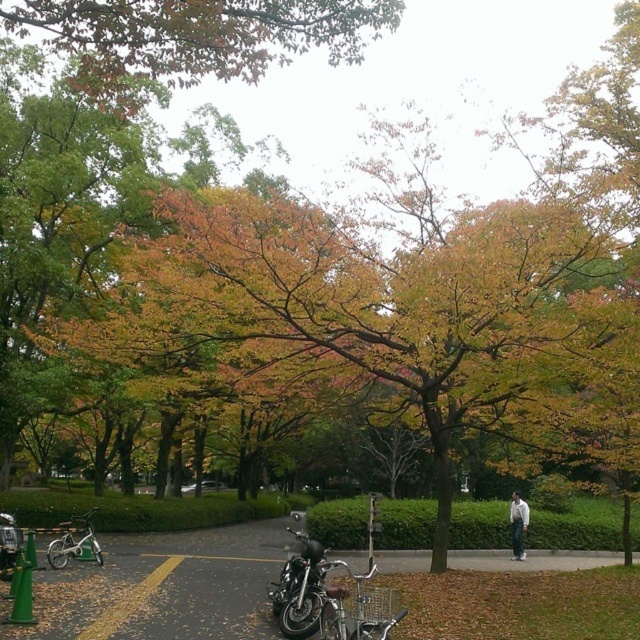
Between orange leafy tree at upper center and shiny metallic bicycle at center, which one has less height?

shiny metallic bicycle at center

Image resolution: width=640 pixels, height=640 pixels. I want to click on orange leafy tree at upper center, so click(196, 35).

Does orange leafy tree at upper center have a lesser width compared to shiny black motorcycle at lower left?

In fact, orange leafy tree at upper center might be wider than shiny black motorcycle at lower left.

Which is below, orange leafy tree at upper center or shiny black motorcycle at lower left?

→ shiny black motorcycle at lower left is below.

This screenshot has width=640, height=640. In order to click on orange leafy tree at upper center in this screenshot , I will do `click(196, 35)`.

This screenshot has height=640, width=640. Identify the location of orange leafy tree at upper center. (196, 35).

Image resolution: width=640 pixels, height=640 pixels. What do you see at coordinates (300, 588) in the screenshot?
I see `shiny chrome motorcycle at center` at bounding box center [300, 588].

I want to click on shiny chrome motorcycle at center, so (x=300, y=588).

Measure the distance between shiny chrome motorcycle at center and camera.

shiny chrome motorcycle at center is 25.80 feet from camera.

This screenshot has height=640, width=640. Identify the location of shiny chrome motorcycle at center. (300, 588).